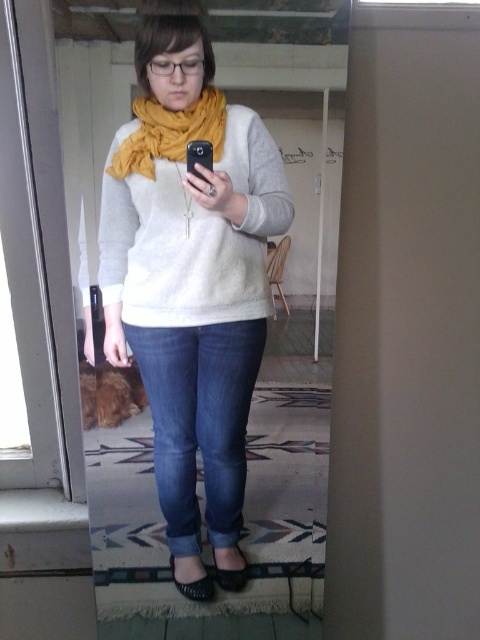
Question: Where is yellow soft scarf at center located in relation to leather at lower center in the image?

Choices:
 (A) below
 (B) above

Answer: (B)

Question: Can you confirm if matte white sweater at center is positioned to the left of leather at lower center?

Choices:
 (A) yes
 (B) no

Answer: (B)

Question: Which object is closer to the camera taking this photo?

Choices:
 (A) black leather sandal at lower center
 (B) leather at lower center

Answer: (B)

Question: Where is yellow soft scarf at center located in relation to leather at lower center in the image?

Choices:
 (A) left
 (B) right

Answer: (A)

Question: Which point is closer to the camera taking this photo?

Choices:
 (A) (212, 589)
 (B) (216, 161)

Answer: (B)

Question: Which object appears farthest from the camera in this image?

Choices:
 (A) denim jeans at center
 (B) fuzzy white sweater at center
 (C) matte white sweater at center
 (D) leather at lower center

Answer: (D)